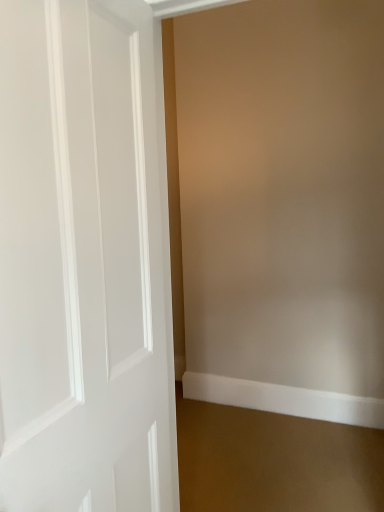
The height and width of the screenshot is (512, 384). Find the location of `blank space above white smooth baseboard at lower right (from a real-world perspective)`. blank space above white smooth baseboard at lower right (from a real-world perspective) is located at coordinates (281, 379).